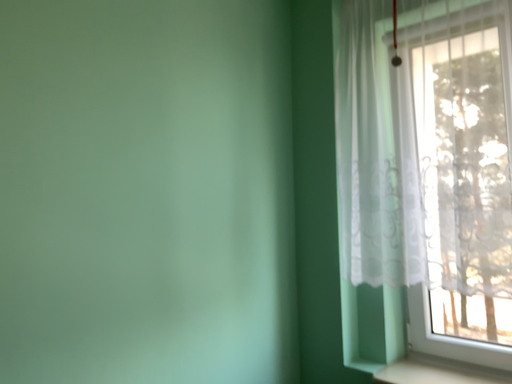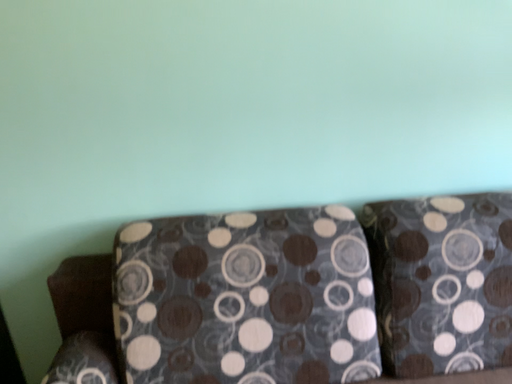
Question: Which way did the camera rotate in the video?

Choices:
 (A) rotated upward
 (B) rotated downward

Answer: (B)